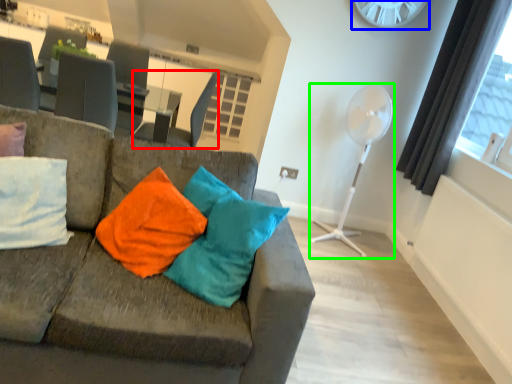
Question: Which object is the closest to the swivel chair (highlighted by a red box)? Choose among these: clock (highlighted by a blue box) or fan (highlighted by a green box).

Choices:
 (A) clock
 (B) fan

Answer: (B)